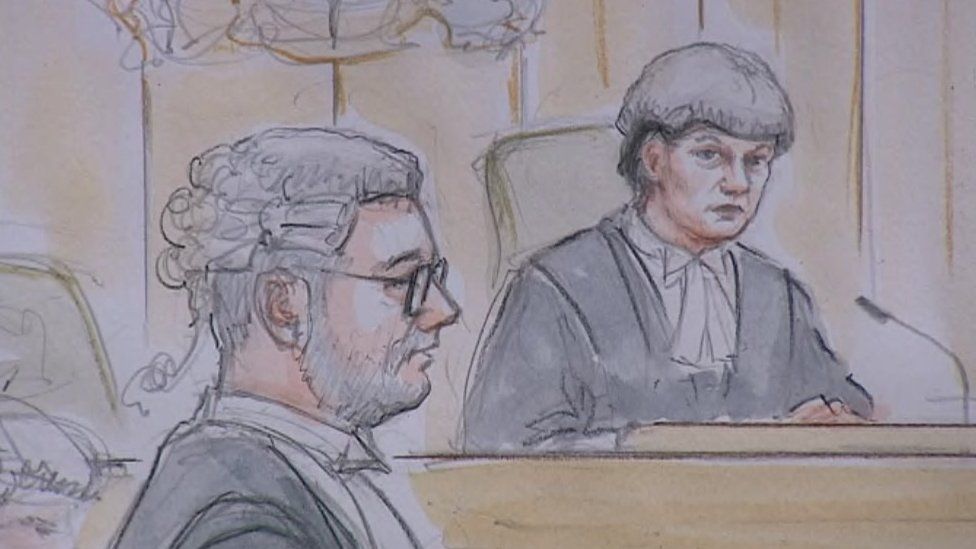
Where is `8 wood panels`? This screenshot has width=976, height=549. 8 wood panels is located at coordinates (965, 201).